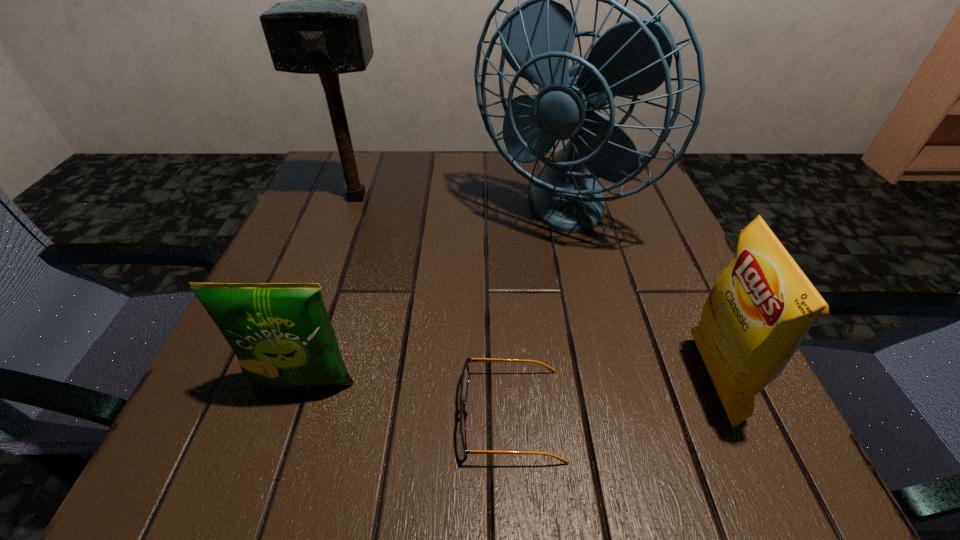
Identify the location of vacant space located on the front of the right crisp (potato chip) with the logo. The image size is (960, 540). (625, 381).

Image resolution: width=960 pixels, height=540 pixels. I want to click on vacant region located 0.080m on the front-facing side of the shortest object, so click(400, 415).

Identify the location of free space located 0.060m on the front-facing side of the shortest object. Image resolution: width=960 pixels, height=540 pixels. (416, 415).

This screenshot has height=540, width=960. I want to click on free region located 0.160m on the front-facing side of the shortest object, so click(x=342, y=415).

You are a GUI agent. You are given a task and a screenshot of the screen. Output one action in this format:
    pyautogui.click(x=<x>, y=<y>)
    Task: Click on the fan situated at the far edge
    
    Given the screenshot: What is the action you would take?
    pyautogui.click(x=633, y=57)

The width and height of the screenshot is (960, 540). In order to click on mallet present at the far edge in this screenshot , I will do `click(319, 33)`.

At what (x,y) coordinates should I click in order to perform the action: click on crisp (potato chip) present at the near edge. Please return your answer as a coordinate pair (x, y). This screenshot has width=960, height=540. Looking at the image, I should click on (759, 310).

In order to click on spectacles located in the near edge section of the desktop in this screenshot , I will do `click(465, 377)`.

Locate an element on the screen. The height and width of the screenshot is (540, 960). mallet situated at the left edge is located at coordinates (319, 33).

The width and height of the screenshot is (960, 540). I want to click on crisp (potato chip) that is at the left edge, so click(x=281, y=333).